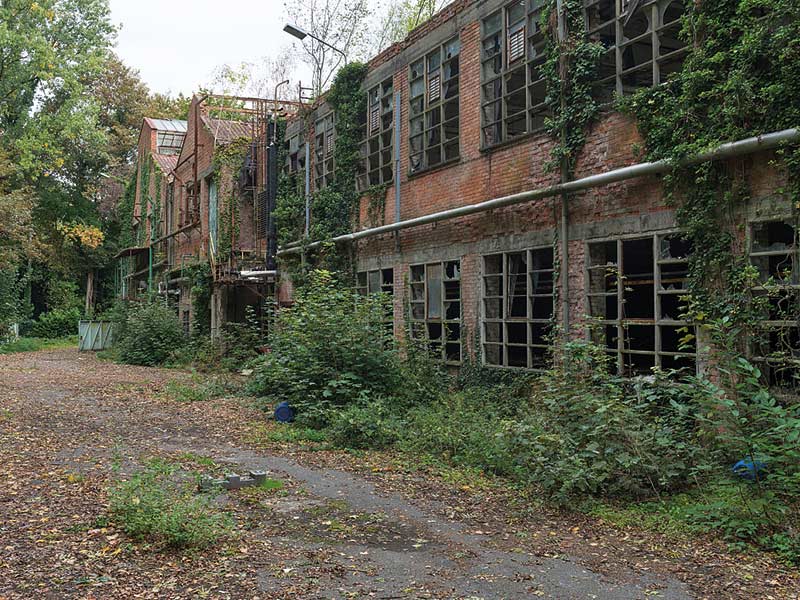
You are a GUI agent. You are given a task and a screenshot of the screen. Output one action in this format:
    pyautogui.click(x=<x>, y=<y>)
    Task: Click on the light
    The image size is (800, 600).
    Given the screenshot: What is the action you would take?
    pyautogui.click(x=298, y=30)